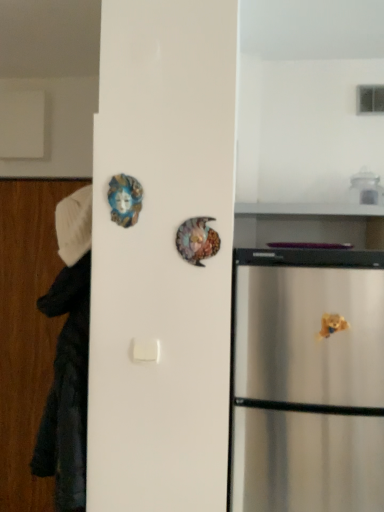
Describe the element at coordinates (67, 390) in the screenshot. This screenshot has height=512, width=384. I see `black matte robe at left` at that location.

Where is `black matte robe at left`? The image size is (384, 512). black matte robe at left is located at coordinates (67, 390).

What is the approximate height of black matte robe at left?

black matte robe at left is 1.90 meters tall.

At what (x,y) coordinates should I click in order to perform the action: click on black matte robe at left. Please return your answer as a coordinate pair (x, y). The width and height of the screenshot is (384, 512). Looking at the image, I should click on (67, 390).